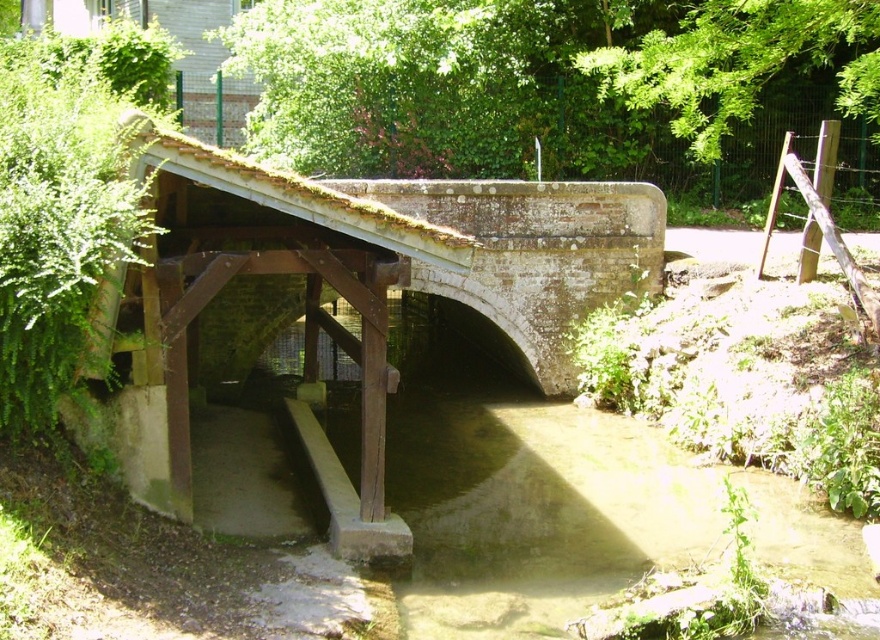
Can you confirm if white stone bridge at center is smaller than brown concrete water at center?

No.

Does white stone bridge at center have a larger size compared to brown concrete water at center?

Correct, white stone bridge at center is larger in size than brown concrete water at center.

What are the coordinates of `white stone bridge at center` in the screenshot? It's located at (352, 292).

Locate an element on the screen. The height and width of the screenshot is (640, 880). white stone bridge at center is located at coordinates (352, 292).